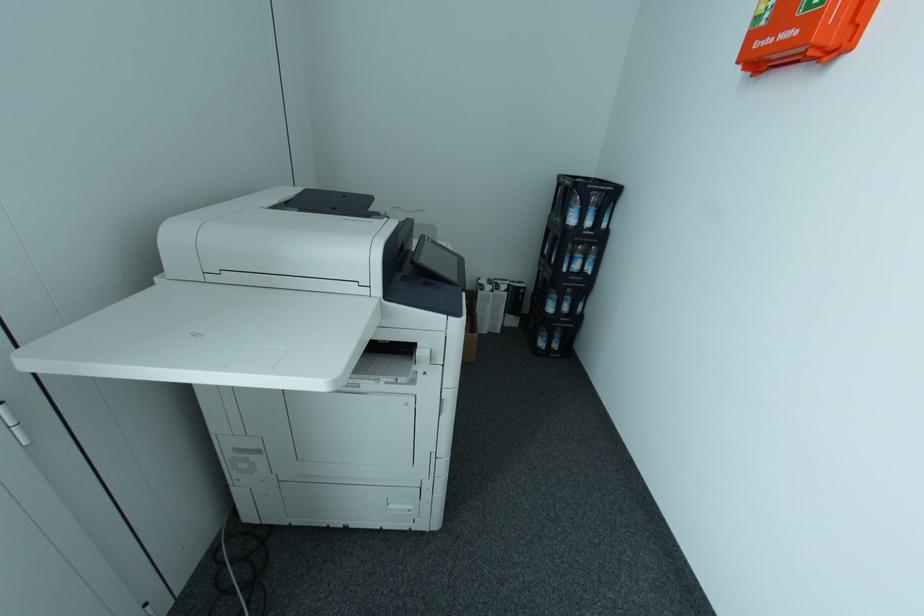
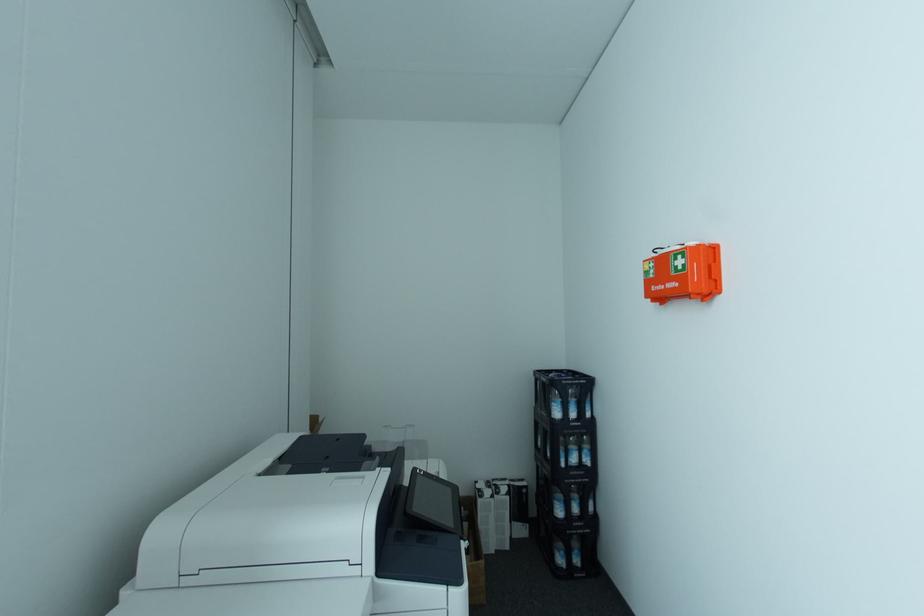
Question: How did the camera likely rotate?

Choices:
 (A) Left
 (B) Right
 (C) Up
 (D) Down

Answer: (C)